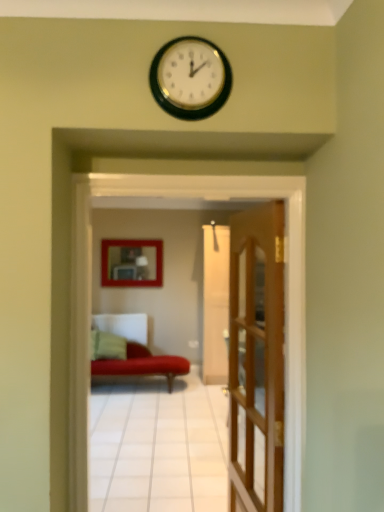
Question: From a real-world perspective, is matte wooden picture frame at center positioned above or below velvet red couch at center?

Choices:
 (A) below
 (B) above

Answer: (B)

Question: From the image's perspective, is matte wooden picture frame at center above or below velvet red couch at center?

Choices:
 (A) above
 (B) below

Answer: (A)

Question: Estimate the real-world distances between objects in this image. Which object is closer to the green fabric pillow at lower left?

Choices:
 (A) velvet red couch at center
 (B) matte wooden picture frame at center
 (C) wooden door at center

Answer: (B)

Question: Estimate the real-world distances between objects in this image. Which object is closer to the matte wooden picture frame at center?

Choices:
 (A) green fabric pillow at lower left
 (B) wooden door at center
 (C) velvet red couch at center

Answer: (A)